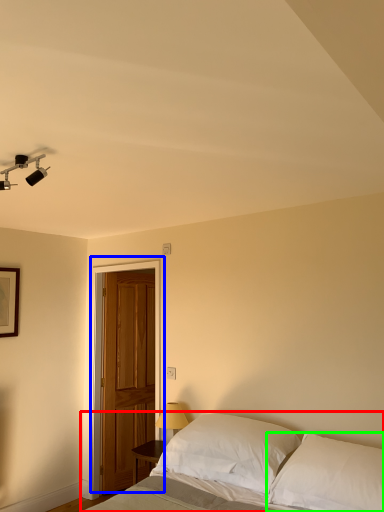
Question: Which object is the farthest from bed (highlighted by a red box)? Choose among these: door (highlighted by a blue box) or pillow (highlighted by a green box).

Choices:
 (A) door
 (B) pillow

Answer: (A)